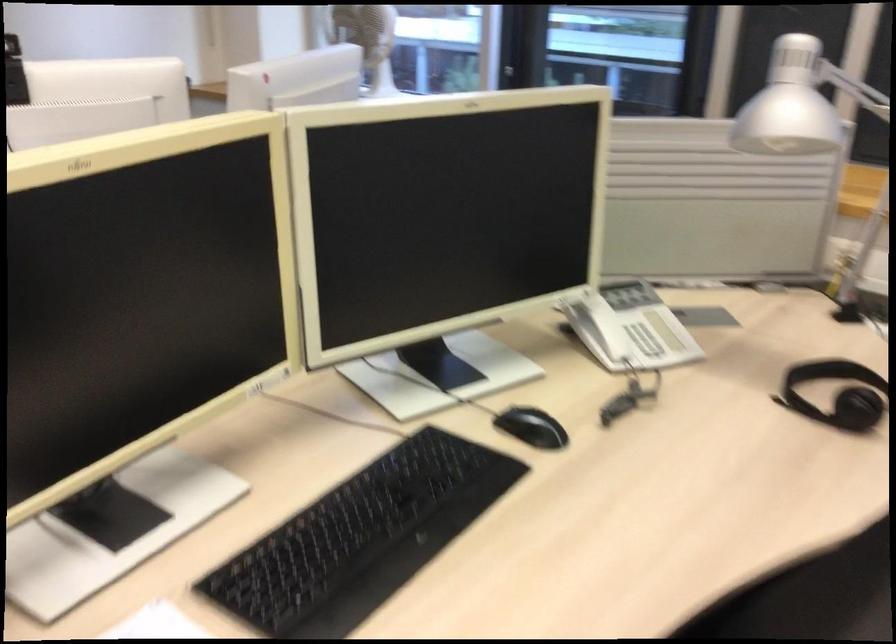
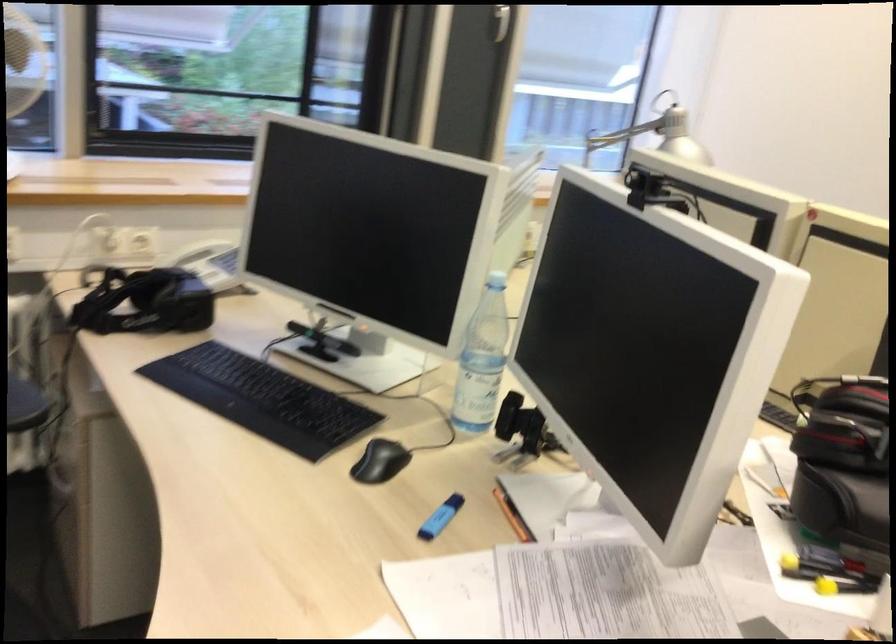
The point at (788, 105) is marked in the first image. Where is the corresponding point in the second image?

(693, 136)